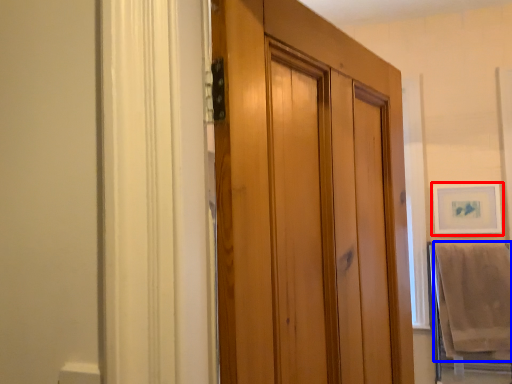
Question: Which point is further to the camera, picture frame (highlighted by a red box) or bath towel (highlighted by a blue box)?

Choices:
 (A) picture frame
 (B) bath towel

Answer: (A)